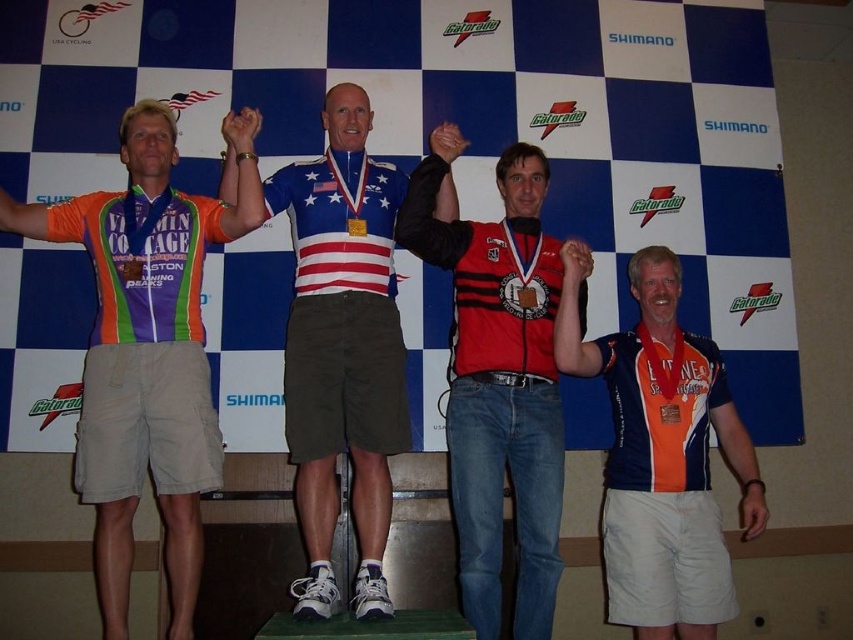
Who is taller, matte jersey at center or red matte vest at center?

matte jersey at center

Is matte jersey at center above red matte vest at center?

Yes.

Measure the distance between point (206, 419) and camera.

Point (206, 419) is 9.12 feet away from camera.

Image resolution: width=853 pixels, height=640 pixels. I want to click on matte jersey at center, so click(148, 348).

Does red matte vest at center appear over matte orange jersey at right?

Yes.

Does red matte vest at center have a larger size compared to matte orange jersey at right?

Yes.

Where is `red matte vest at center`? red matte vest at center is located at coordinates (498, 380).

Based on the photo, is american flag jersey at center thinner than red matte vest at center?

Incorrect, american flag jersey at center's width is not less than red matte vest at center's.

Describe the element at coordinates (341, 349) in the screenshot. I see `american flag jersey at center` at that location.

At what (x,y) coordinates should I click in order to perform the action: click on american flag jersey at center. Please return your answer as a coordinate pair (x, y). The width and height of the screenshot is (853, 640). Looking at the image, I should click on (341, 349).